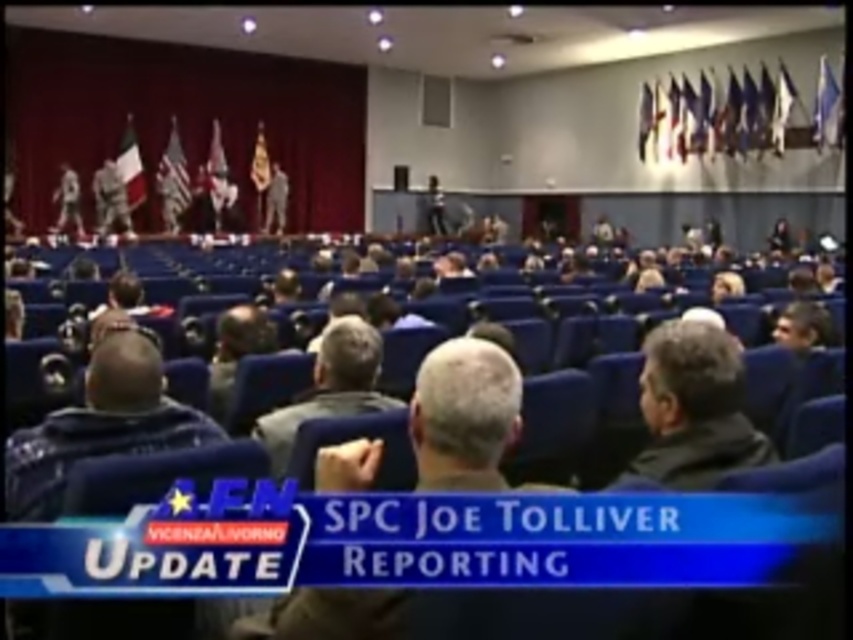
Who is positioned more to the left, dark blue jacket at lower left or gray matte jacket at center?

dark blue jacket at lower left is more to the left.

Is point (161, 403) positioned behind point (664, 449)?

Yes, point (161, 403) is farther from viewer.

You are a GUI agent. You are given a task and a screenshot of the screen. Output one action in this format:
    pyautogui.click(x=<x>, y=<y>)
    Task: Click on the dark blue jacket at lower left
    
    Given the screenshot: What is the action you would take?
    pyautogui.click(x=100, y=424)

Does gray matte jacket at center have a larger size compared to gray fabric jacket at center?

Yes, gray matte jacket at center is bigger than gray fabric jacket at center.

Is gray matte jacket at center wider than gray fabric jacket at center?

Correct, the width of gray matte jacket at center exceeds that of gray fabric jacket at center.

Does point (672, 451) lie behind point (328, 372)?

No, (672, 451) is in front of (328, 372).

Locate an element on the screen. The image size is (853, 640). gray matte jacket at center is located at coordinates (692, 410).

Between dark blue jacket at lower left and gray fabric jacket at center, which one appears on the right side from the viewer's perspective?

Positioned to the right is gray fabric jacket at center.

Which is in front, point (144, 364) or point (323, 353)?

Point (144, 364)

Locate an element on the screen. The width and height of the screenshot is (853, 640). dark blue jacket at lower left is located at coordinates (100, 424).